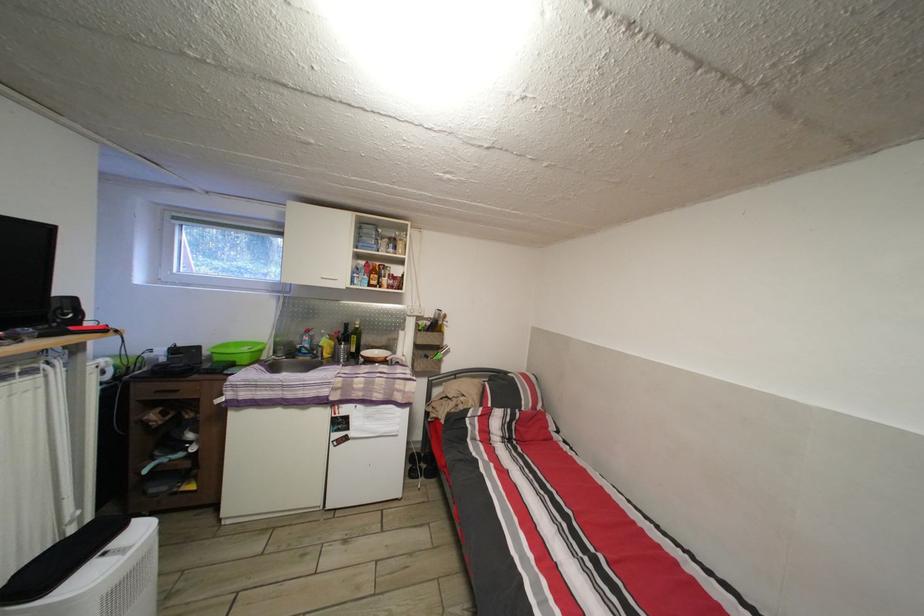
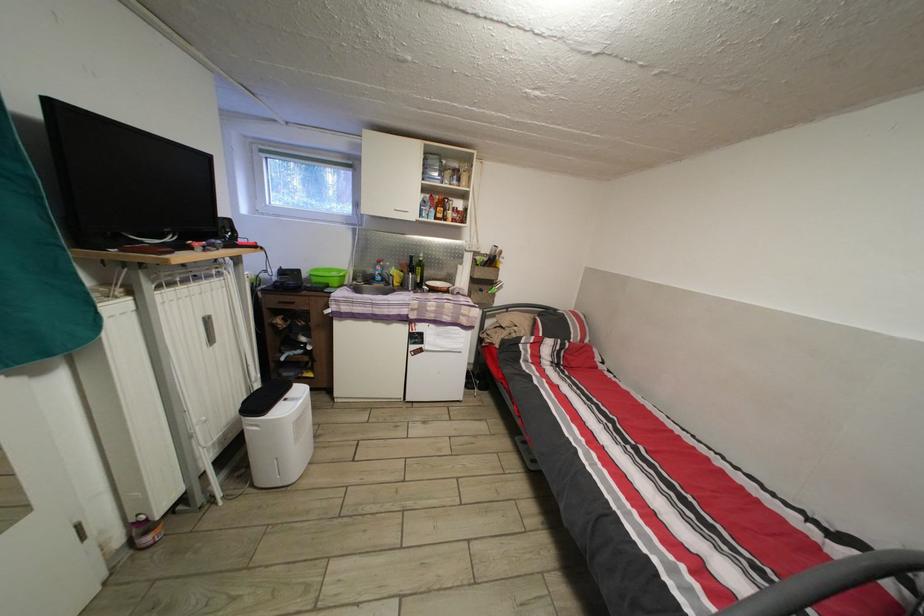
Where in the second image is the point corresponding to the point at 327,355 from the first image?

(398, 285)